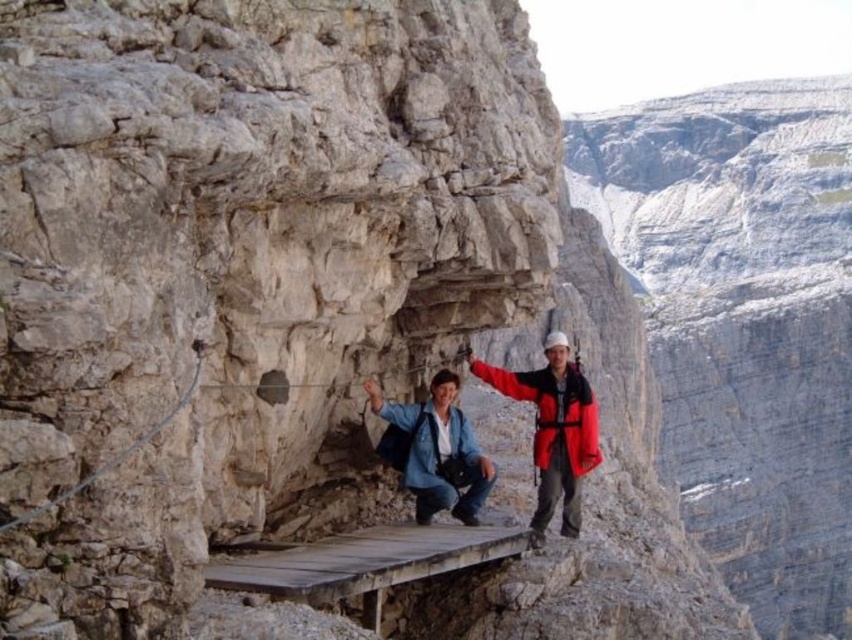
Between gray rock cliff at right and matte blue jacket at center, which one is positioned lower?

matte blue jacket at center is lower down.

Who is more distant from viewer, (792, 470) or (470, 497)?

Positioned behind is point (792, 470).

At what (x,y) coordinates should I click in order to perform the action: click on gray rock cliff at right. Please return your answer as a coordinate pair (x, y). This screenshot has height=640, width=852. Looking at the image, I should click on (743, 323).

Does gray rock cliff at right have a lesser width compared to denim jacket at center?

No, gray rock cliff at right is not thinner than denim jacket at center.

Does gray rock cliff at right lie behind denim jacket at center?

Yes, gray rock cliff at right is further from the viewer.

Does point (642, 211) come behind point (448, 426)?

Yes, point (642, 211) is behind point (448, 426).

Locate an element on the screen. The width and height of the screenshot is (852, 640). gray rock cliff at right is located at coordinates (743, 323).

Between matte blue jacket at center and wooden bridge at center, which one is positioned lower?

wooden bridge at center is lower down.

At what (x,y) coordinates should I click in order to perform the action: click on matte blue jacket at center. Please return your answer as a coordinate pair (x, y). The width and height of the screenshot is (852, 640). Looking at the image, I should click on (553, 428).

Does point (482, 490) lie behind point (223, 563)?

Yes.

The image size is (852, 640). What are the coordinates of `matte blue jacket at center` in the screenshot? It's located at (553, 428).